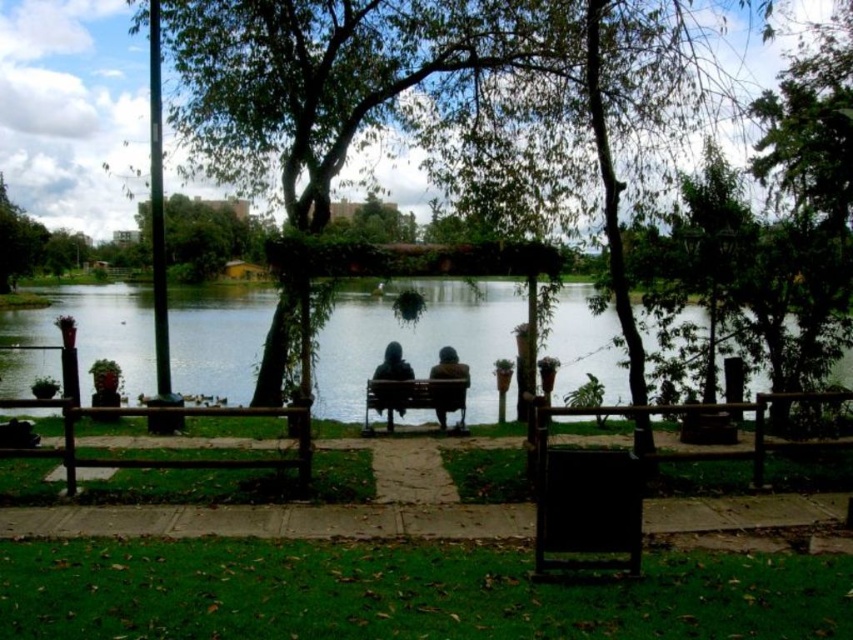
You are standing at the point with coordinates point (436, 100). Which object from the scene are you currently standing on?

The point (436, 100) is on green leafy tree at center.

You are standing at the edge of the park and want to reach the point marked at coordinates point (x=434, y=374). Given that you can walk 30 feet per minute, how many minutes will it take you to reach that point?

The point marked at coordinates point (x=434, y=374) is 45.77 feet away from the viewer. At a walking speed of 30 feet per minute, it will take approximately 1.526 minutes to reach the point. Since we usually round to the nearest whole number, it would take about 2 minutes.

From the picture: You are standing at the park entrance and see the green leafy tree at center and the dark brown leather jacket at center. Which object is nearer to you?

The green leafy tree at center is closer to the viewer than the dark brown leather jacket at center, so the green leafy tree at center is nearer to you.